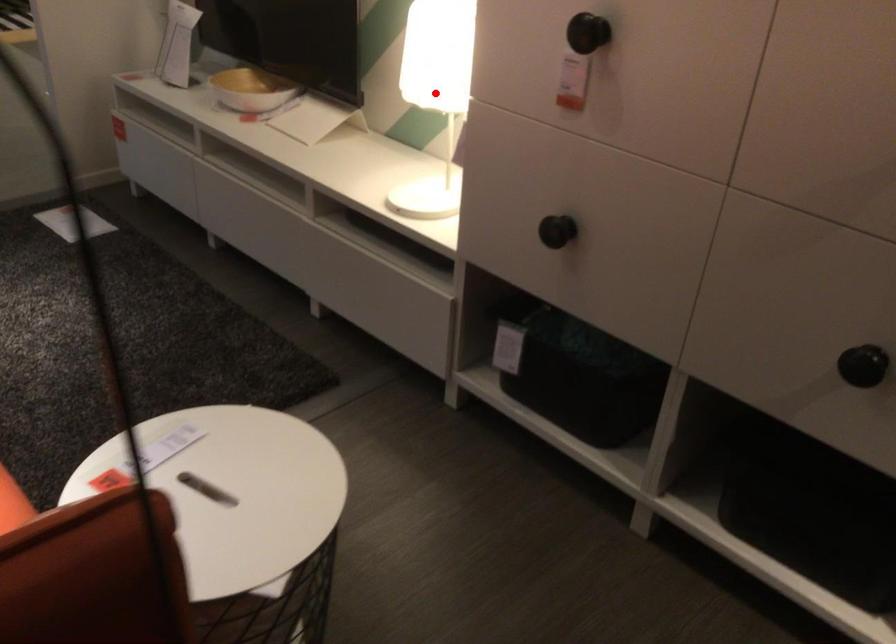
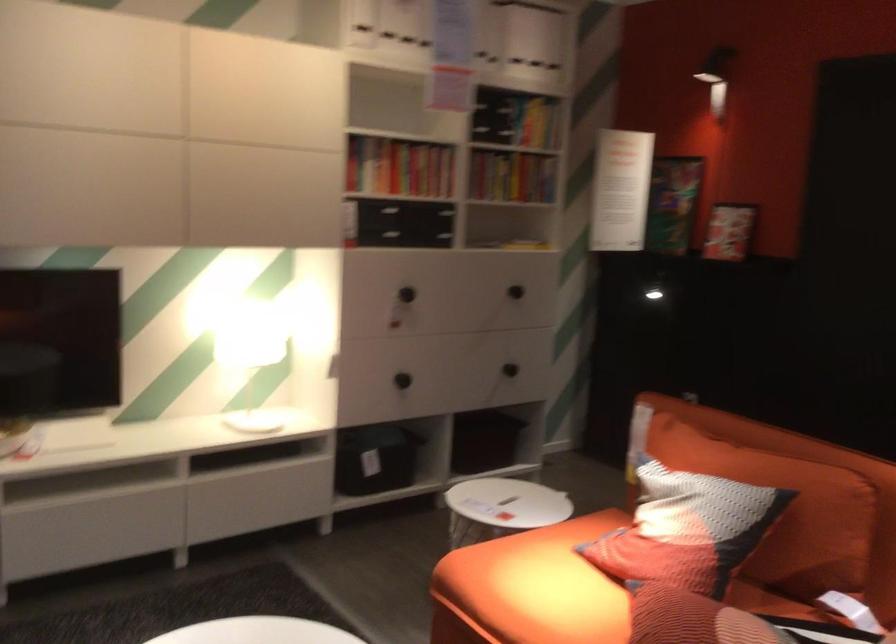
Question: I am providing you with two images of the same scene from different viewpoints. Given a red point in image1, look at the same physical point in image2. Is it:

Choices:
 (A) Closer to the viewpoint
 (B) Farther from the viewpoint

Answer: (B)